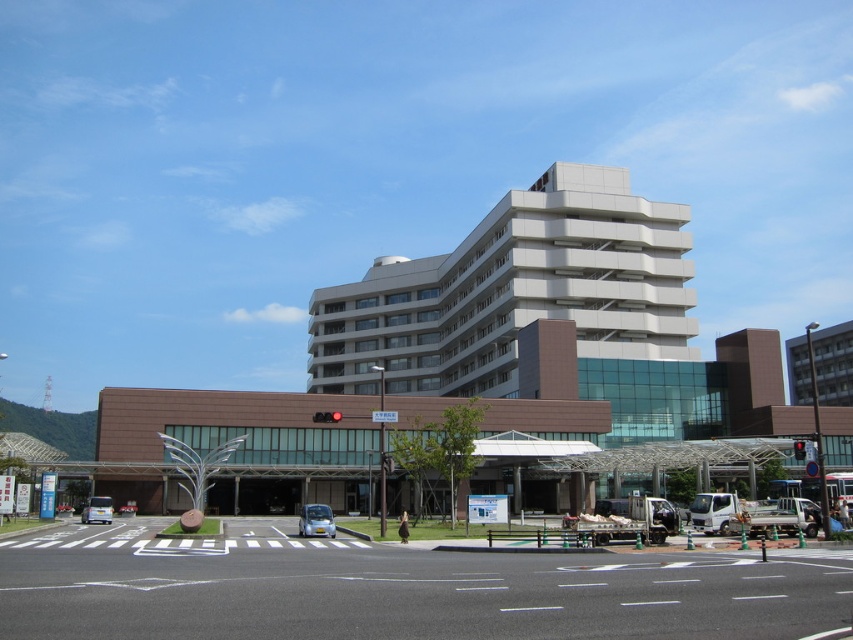
Question: Does white smooth building at center appear on the right side of red glass traffic light at center?

Choices:
 (A) yes
 (B) no

Answer: (A)

Question: Is white asphalt road at lower center thinner than silver metallic car at lower left?

Choices:
 (A) yes
 (B) no

Answer: (B)

Question: Which of the following is the farthest from the observer?

Choices:
 (A) red glass traffic light at center
 (B) white smooth building at center
 (C) metallic blue car at center
 (D) silver metallic car at lower left

Answer: (B)

Question: Which object appears closest to the camera in this image?

Choices:
 (A) white asphalt road at lower center
 (B) red glass traffic light at center
 (C) white smooth building at center

Answer: (A)

Question: Can you confirm if white asphalt road at lower center is positioned above red glass traffic light at center?

Choices:
 (A) yes
 (B) no

Answer: (B)

Question: Which point appears farthest from the camera in this image?

Choices:
 (A) (570, 221)
 (B) (316, 512)
 (C) (102, 520)

Answer: (A)